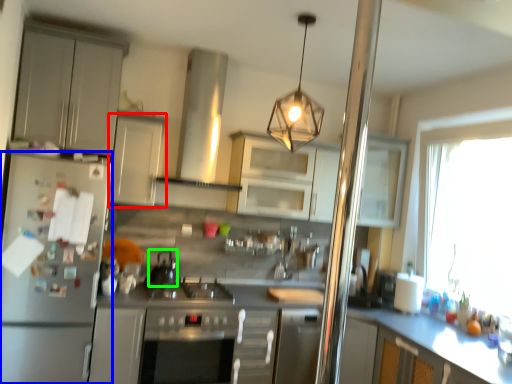
Question: Considering the real-world distances, which object is farthest from cabinetry (highlighted by a red box)? kitchen appliance (highlighted by a blue box) or appliance (highlighted by a green box)?

Choices:
 (A) kitchen appliance
 (B) appliance

Answer: (B)